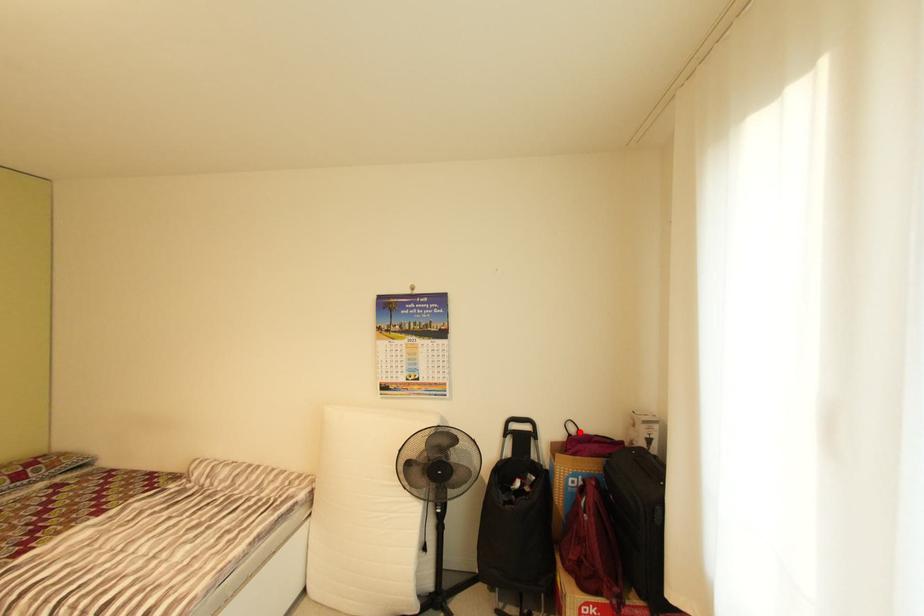
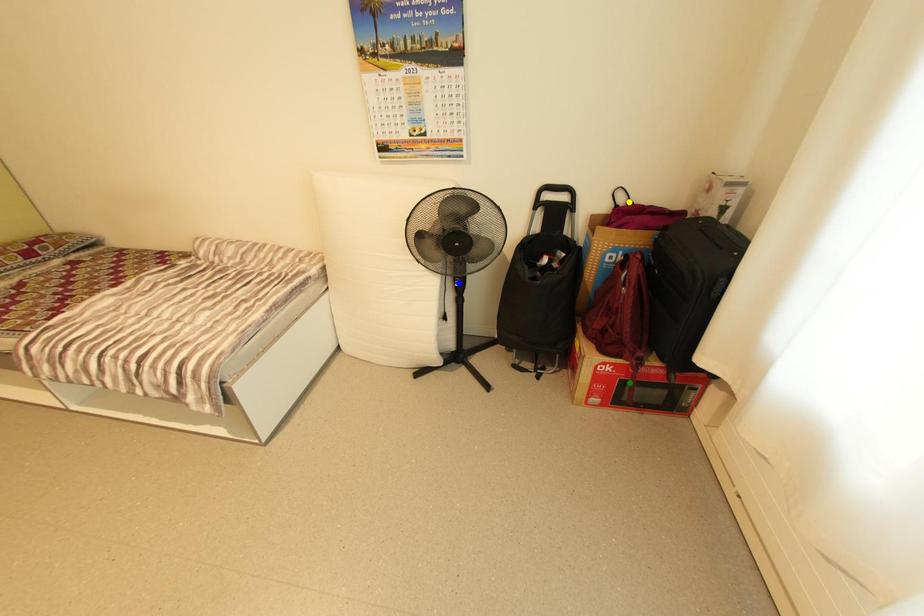
Question: I am providing you with two images of the same scene from different viewpoints. A red point is marked on the first image. You are given multiple points on the second image. Which mark in image 2 goes with the point in image 1?

Choices:
 (A) yellow point
 (B) blue point
 (C) green point

Answer: (A)